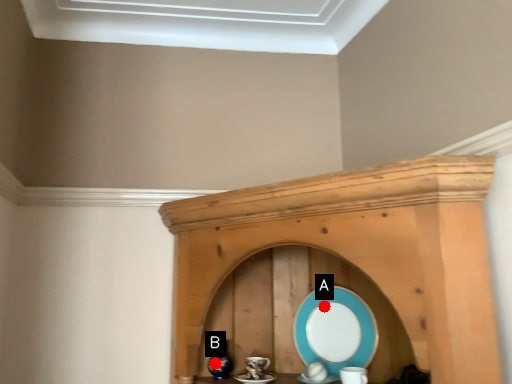
Question: Two points are circled on the image, labeled by A and B beside each circle. Which point appears closest to the camera in this image?

Choices:
 (A) A is closer
 (B) B is closer

Answer: (B)